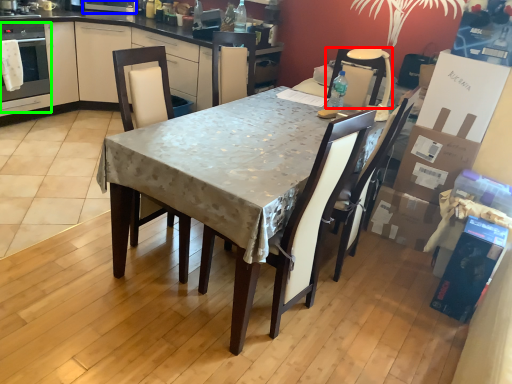
Question: Which object is positioned closest to chair (highlighted by a red box)? Select from appliance (highlighted by a blue box) and oven (highlighted by a green box).

Choices:
 (A) appliance
 (B) oven

Answer: (A)